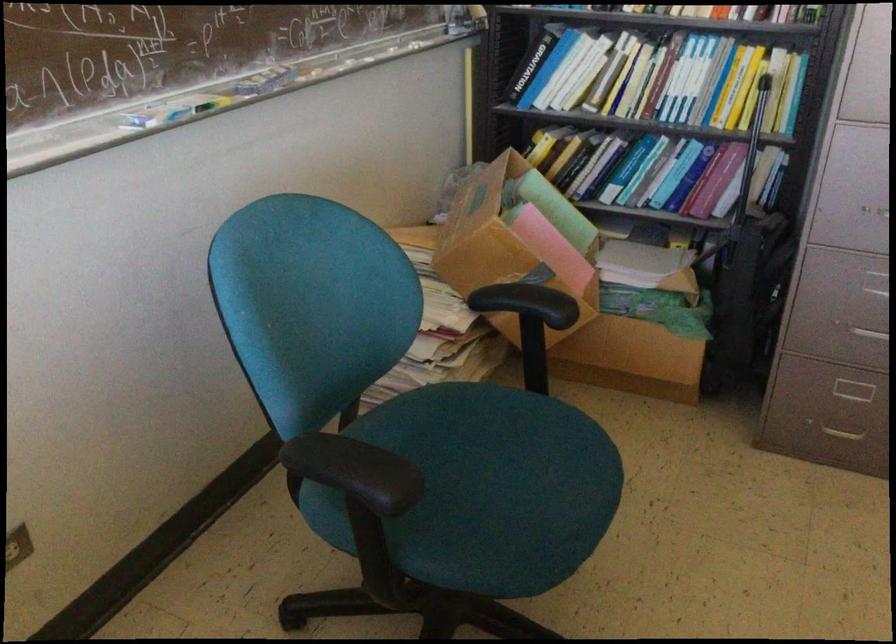
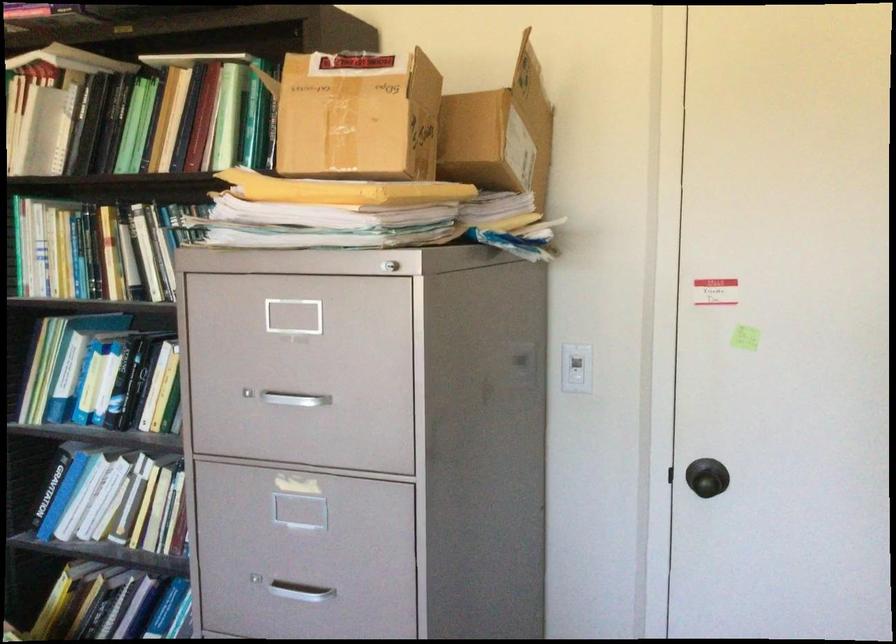
Locate, in the second image, the point that corresponds to pixel 590 73 in the first image.

(117, 502)